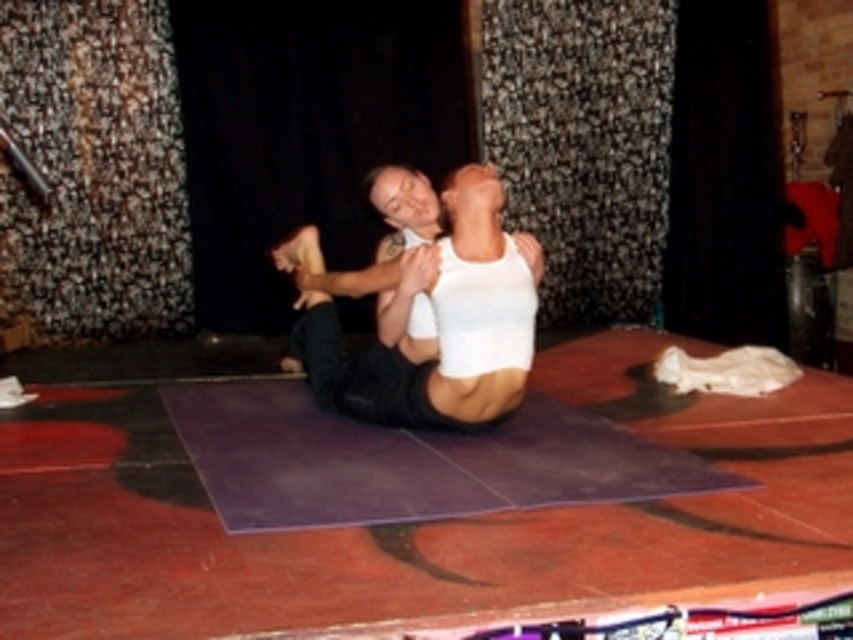
You are an acrobat preparing to perform on the purple rubber mat at center. The stage manager tells you that the center of the performance area is at coordinate point 0.5, 0.5. Is your mat positioned to the left or right of the center?

The purple rubber mat at center is positioned to the right of the center since its coordinates are (409, 460), which is east of the (426, 320) center point.

Consider the image. You are standing in front of the performance area with a 3.5 meters long ladder. You need to place the ladder so that its base is at the point marked as point (398, 461). Will the ladder extend beyond the performance area if placed there?

The point (398, 461) is 3.22 meters away from the viewer. Since the ladder is 3.5 meters long, placing it at that point would cause the ladder to extend 0.28 meters beyond the performance area.